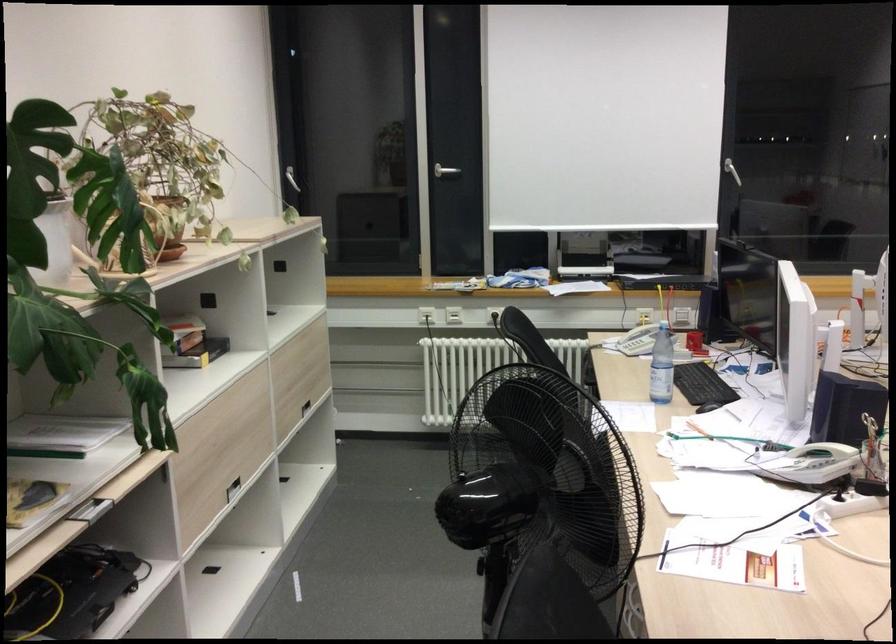
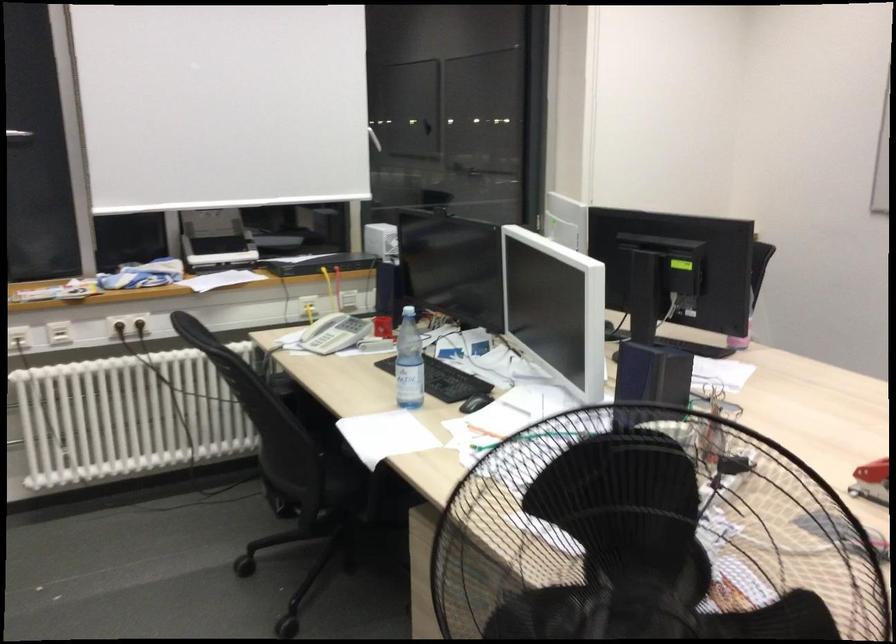
Question: The camera is either moving clockwise (left) or counter-clockwise (right) around the object. The first image is from the beginning of the video and the second image is from the end. Is the camera moving left or right when shooting the video?

Choices:
 (A) Left
 (B) Right

Answer: (A)